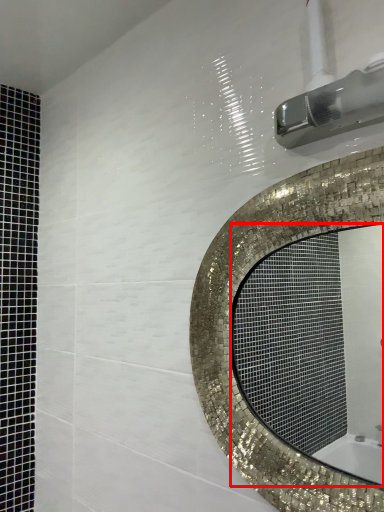
Question: From the image's perspective, where is mirror (annotated by the red box) located in relation to shower in the image?

Choices:
 (A) above
 (B) below

Answer: (B)